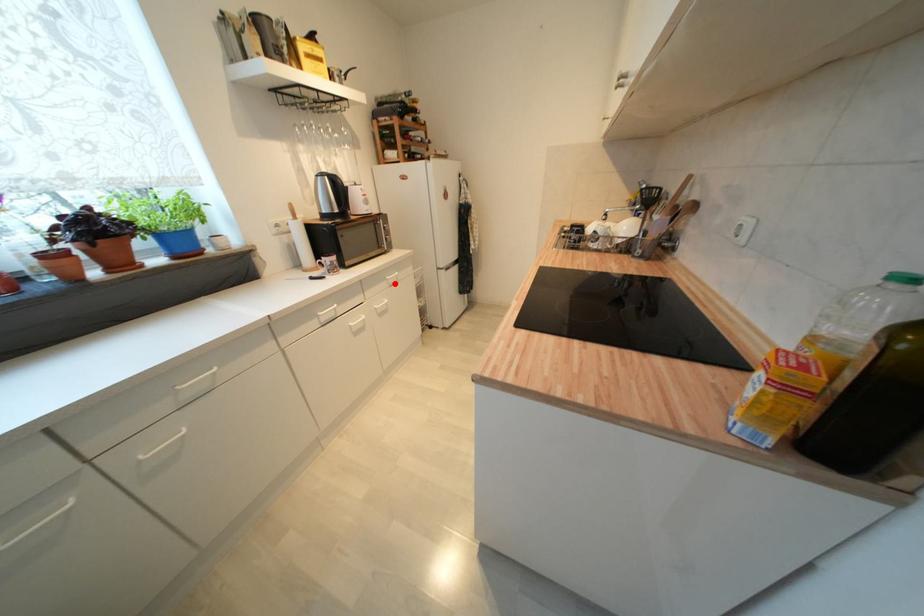
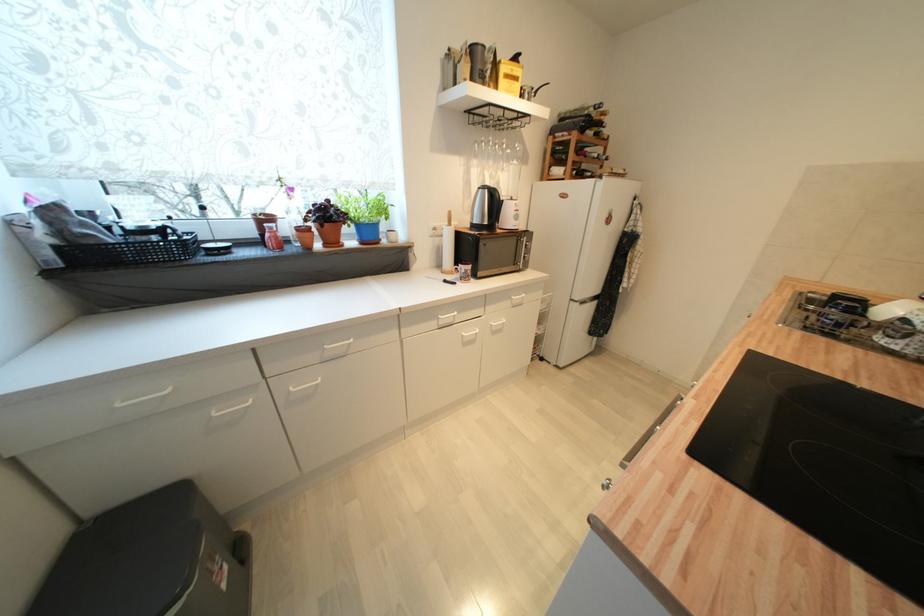
Find the pixel in the second image that matches the highlighted location in the first image.

(518, 304)